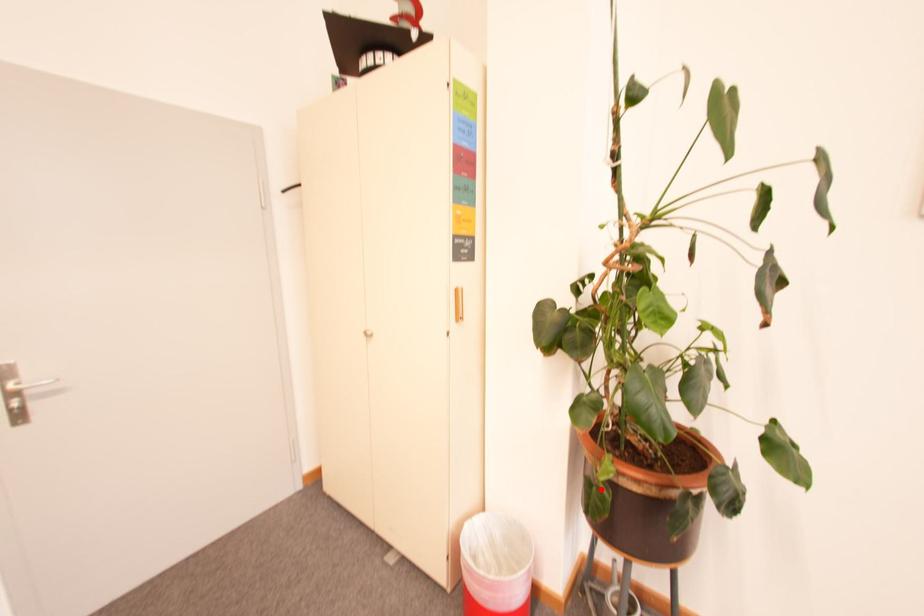
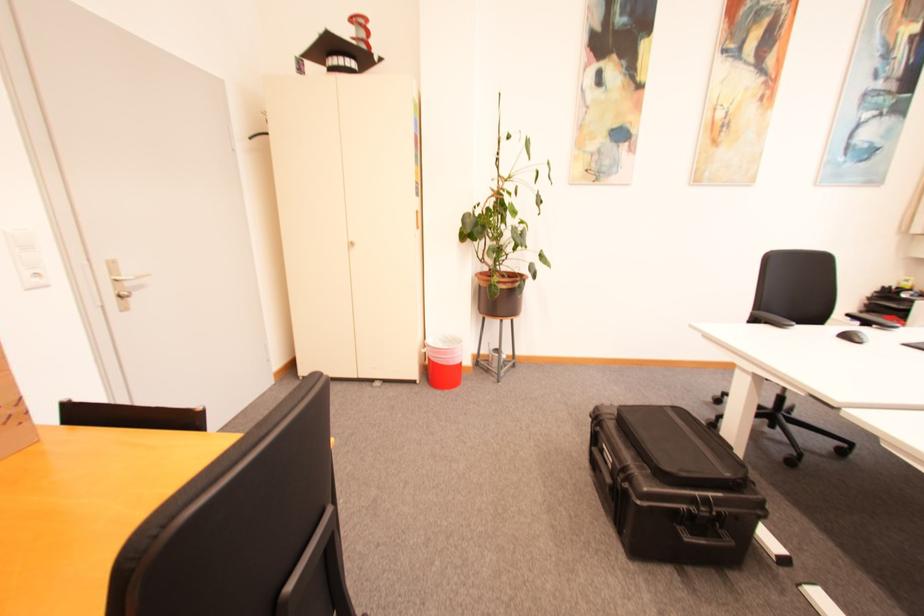
Locate, in the second image, the point that corresponds to the highlighted location in the first image.

(500, 286)